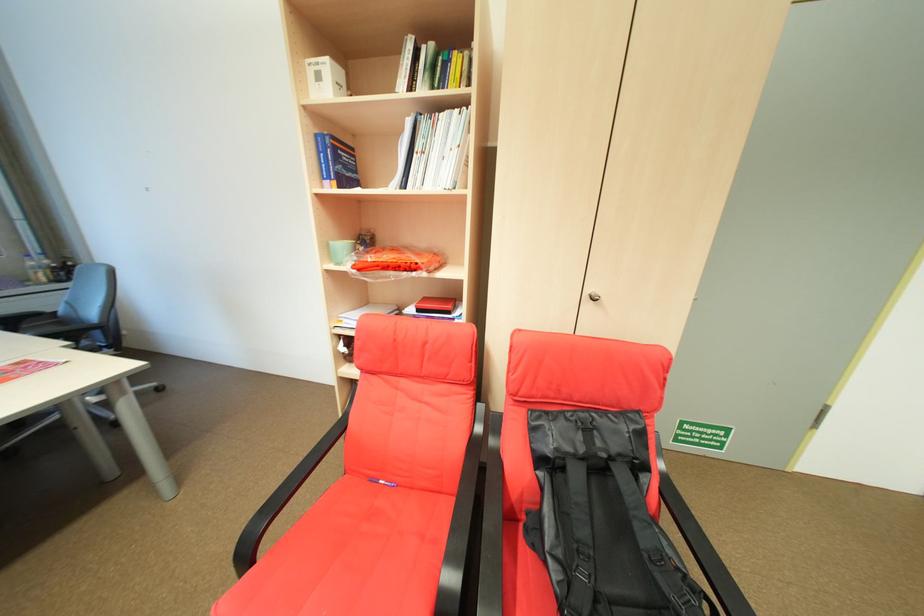
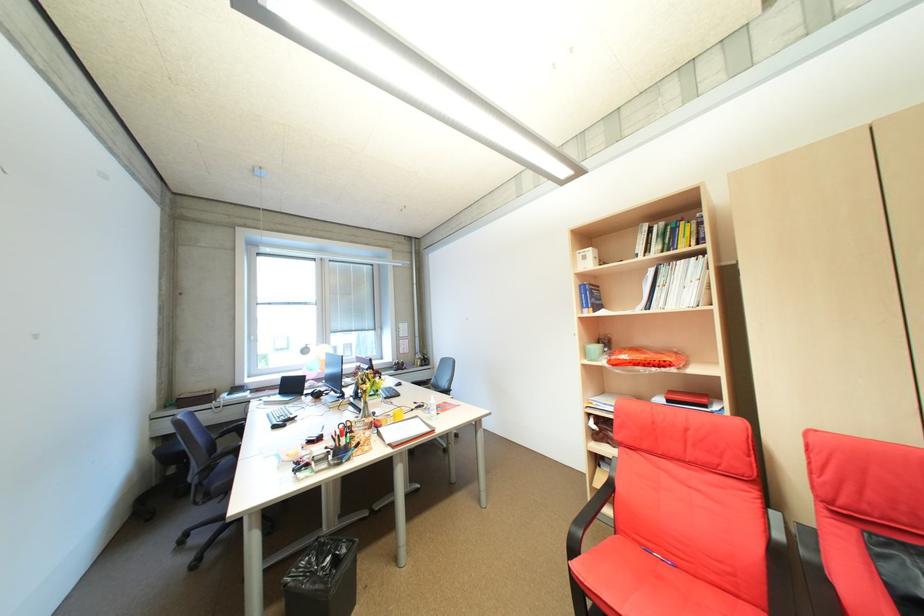
The point at (344,148) is marked in the first image. Where is the corresponding point in the second image?

(600, 291)